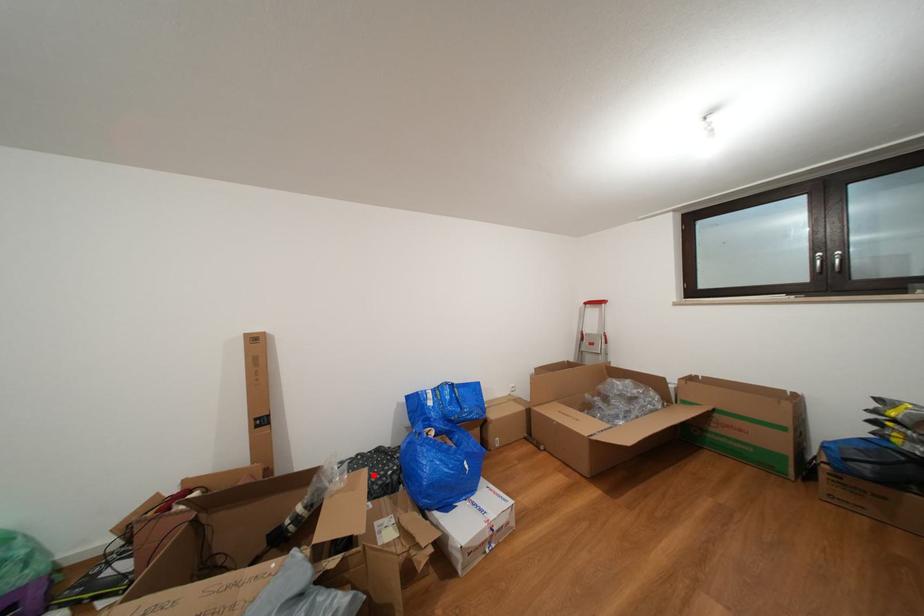
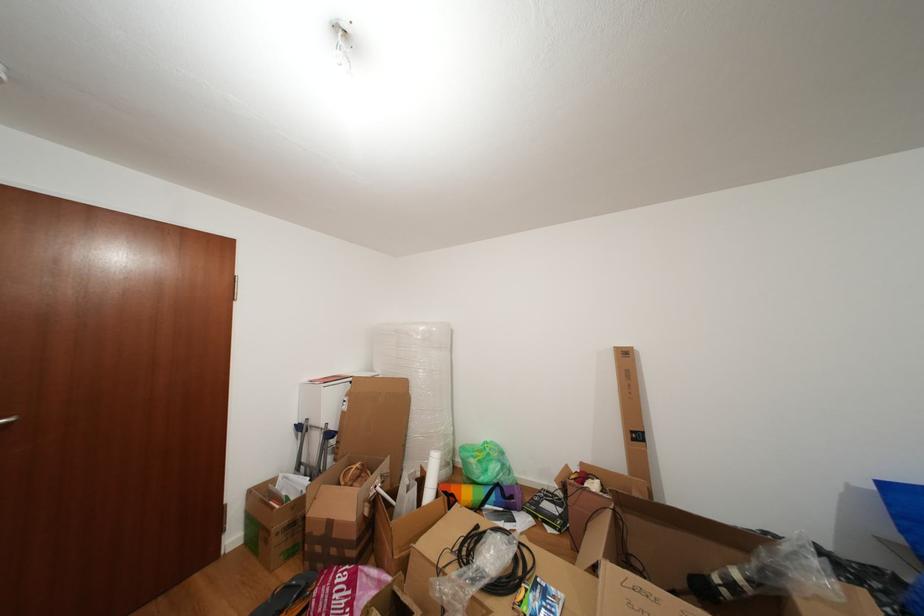
In the second image, find the point that corresponds to the highlighted location in the first image.

(871, 598)